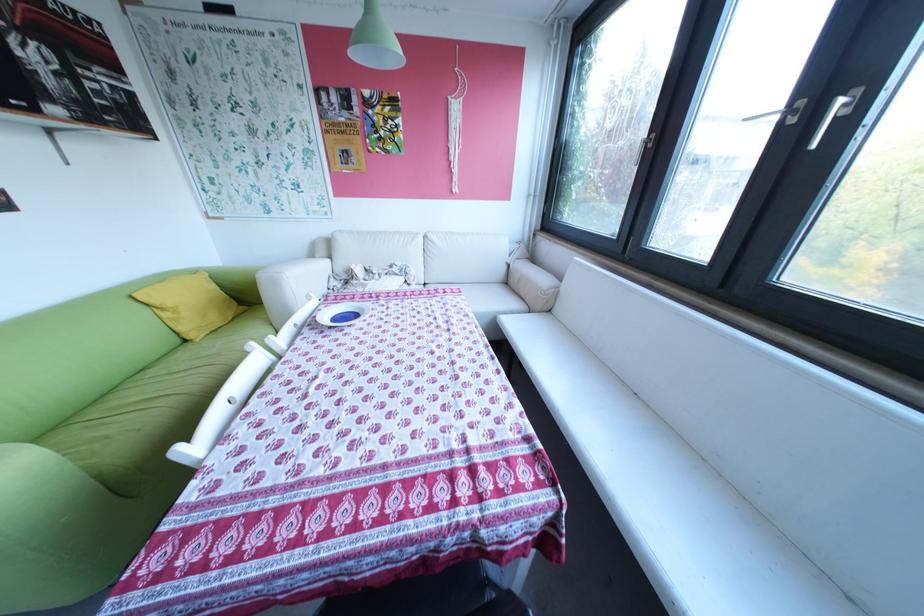
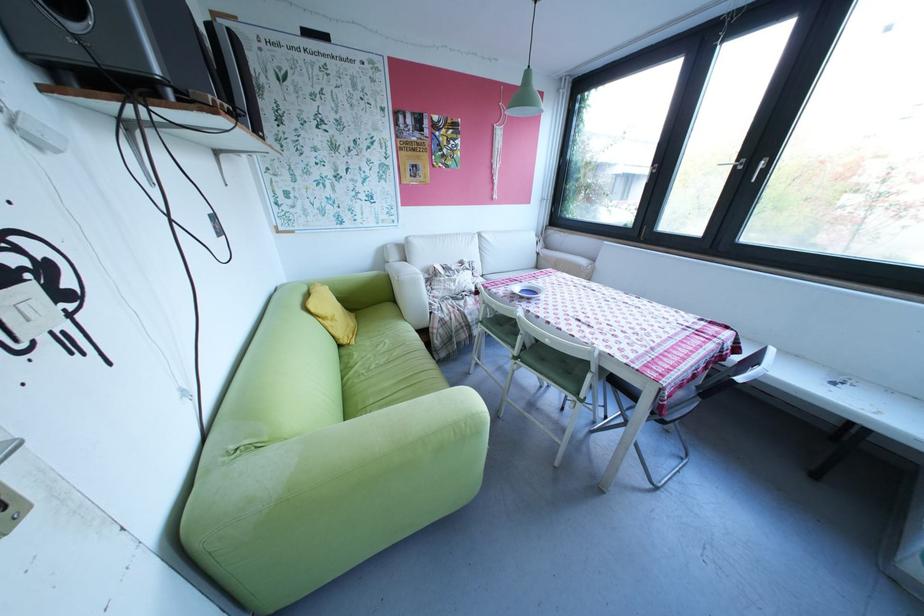
Locate, in the second image, the point that corresponds to the point at 395,132 in the first image.

(457, 151)